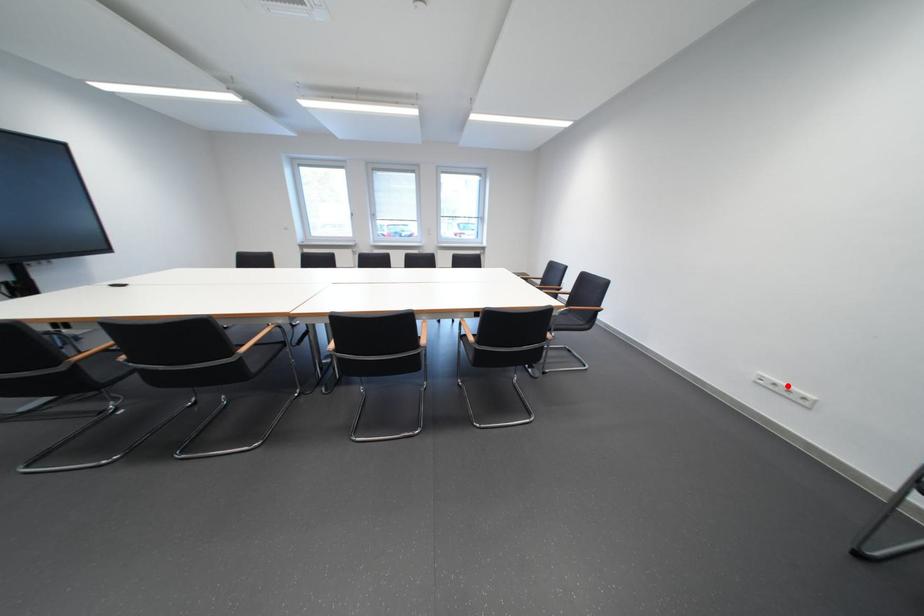
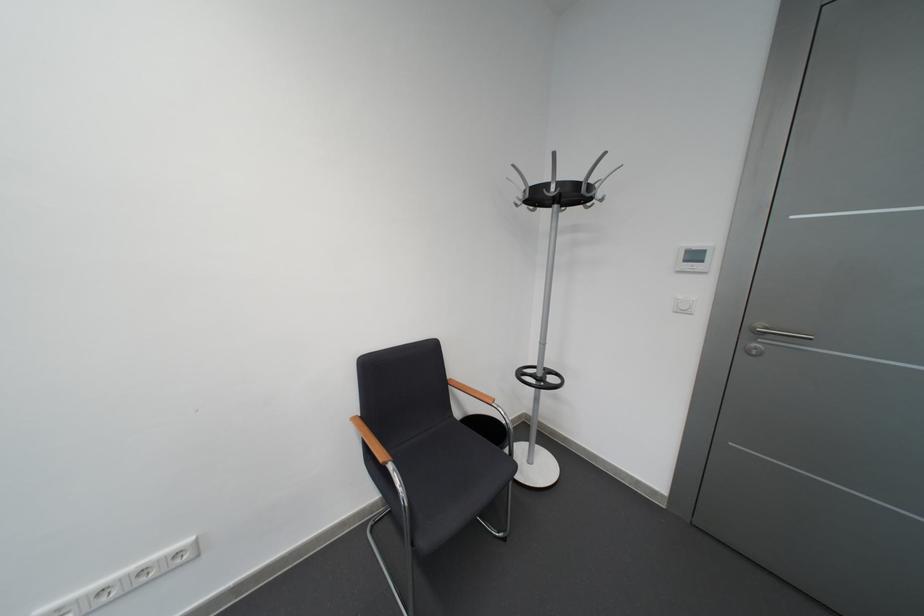
Question: I am providing you with two images of the same scene from different viewpoints. A red point is shown in image1. For the corresponding object point in image2, is it positioned nearer or farther from the camera?

Choices:
 (A) Nearer
 (B) Farther

Answer: (A)